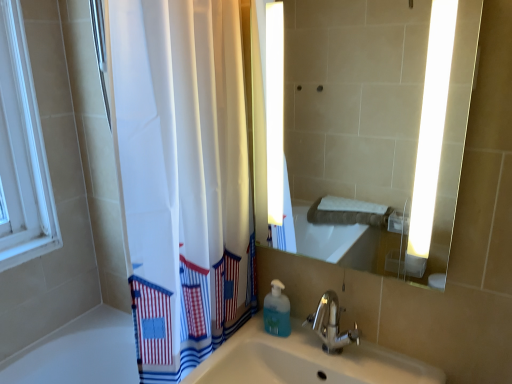
The height and width of the screenshot is (384, 512). What do you see at coordinates (277, 311) in the screenshot? I see `blue translucent soap dispenser at lower center` at bounding box center [277, 311].

Describe the element at coordinates (354, 97) in the screenshot. I see `matte glass mirror at center` at that location.

You are a GUI agent. You are given a task and a screenshot of the screen. Output one action in this format:
    pyautogui.click(x=<x>, y=<y>)
    Task: Click on the chrome metallic faucet at center
    The height and width of the screenshot is (384, 512).
    Given the screenshot: What is the action you would take?
    pyautogui.click(x=331, y=324)

Is blue translucent soap dispenser at lower center located within matte glass mirror at center?

That's incorrect, blue translucent soap dispenser at lower center is not inside matte glass mirror at center.

Could you tell me if matte glass mirror at center is turned towards blue translucent soap dispenser at lower center?

No, matte glass mirror at center is not aimed at blue translucent soap dispenser at lower center.

From the image's perspective, between matte glass mirror at center and blue translucent soap dispenser at lower center, who is located below?

From the image's view, blue translucent soap dispenser at lower center is below.

Is matte glass mirror at center behind blue translucent soap dispenser at lower center?

No, the depth of matte glass mirror at center is less than that of blue translucent soap dispenser at lower center.

Find the location of a particular element. The image size is (512, 384). soap dispenser below the chrome metallic faucet at center (from a real-world perspective) is located at coordinates (277, 311).

Is chrome metallic faucet at center positioned with its back to blue translucent soap dispenser at lower center?

chrome metallic faucet at center does not have its back to blue translucent soap dispenser at lower center.

Is chrome metallic faucet at center shorter than blue translucent soap dispenser at lower center?

No, chrome metallic faucet at center is not shorter than blue translucent soap dispenser at lower center.

Who is smaller, chrome metallic faucet at center or blue translucent soap dispenser at lower center?

With smaller size is blue translucent soap dispenser at lower center.

Consider the image. Is matte glass mirror at center aimed at chrome metallic faucet at center?

No, matte glass mirror at center is not facing towards chrome metallic faucet at center.

From the picture: From a real-world perspective, is matte glass mirror at center located higher than chrome metallic faucet at center?

Indeed, from a real-world perspective, matte glass mirror at center stands above chrome metallic faucet at center.

Based on the photo, is matte glass mirror at center situated inside chrome metallic faucet at center or outside?

matte glass mirror at center exists outside the volume of chrome metallic faucet at center.

Considering the sizes of objects blue translucent soap dispenser at lower center and matte glass mirror at center in the image provided, who is smaller, blue translucent soap dispenser at lower center or matte glass mirror at center?

With smaller size is blue translucent soap dispenser at lower center.

Is blue translucent soap dispenser at lower center taller than matte glass mirror at center?

Incorrect, the height of blue translucent soap dispenser at lower center is not larger of that of matte glass mirror at center.

How many degrees apart are the facing directions of blue translucent soap dispenser at lower center and matte glass mirror at center?

0.0996 degrees separate the facing orientations of blue translucent soap dispenser at lower center and matte glass mirror at center.

Considering the relative sizes of blue translucent soap dispenser at lower center and chrome metallic faucet at center in the image provided, is blue translucent soap dispenser at lower center smaller than chrome metallic faucet at center?

Indeed, blue translucent soap dispenser at lower center has a smaller size compared to chrome metallic faucet at center.

Is point (280, 320) farther from viewer compared to point (331, 310)?

No, it is not.

In the image, there is a chrome metallic faucet at center. At what (x,y) coordinates should I click in order to perform the action: click on soap dispenser below it (from a real-world perspective). Please return your answer as a coordinate pair (x, y). Looking at the image, I should click on (277, 311).

Is blue translucent soap dispenser at lower center positioned beyond the bounds of chrome metallic faucet at center?

That's correct, blue translucent soap dispenser at lower center is outside of chrome metallic faucet at center.

The image size is (512, 384). Identify the location of tap that appears on the left of matte glass mirror at center. (331, 324).

Is chrome metallic faucet at center wider than matte glass mirror at center?

Indeed, chrome metallic faucet at center has a greater width compared to matte glass mirror at center.

Choose the correct answer: Is chrome metallic faucet at center inside matte glass mirror at center or outside it?

chrome metallic faucet at center is spatially situated outside matte glass mirror at center.

In the image, is chrome metallic faucet at center positioned in front of or behind matte glass mirror at center?

Visually, chrome metallic faucet at center is located behind matte glass mirror at center.

This screenshot has height=384, width=512. Find the location of `soap dispenser behind the matte glass mirror at center`. soap dispenser behind the matte glass mirror at center is located at coordinates coord(277,311).

I want to click on tap below the blue translucent soap dispenser at lower center (from the image's perspective), so click(x=331, y=324).

Based on the photo, considering their positions, is matte glass mirror at center positioned closer to blue translucent soap dispenser at lower center than chrome metallic faucet at center?

Among the two, chrome metallic faucet at center is located nearer to blue translucent soap dispenser at lower center.

Considering their positions, is blue translucent soap dispenser at lower center positioned further to chrome metallic faucet at center than matte glass mirror at center?

Among the two, matte glass mirror at center is located further to chrome metallic faucet at center.

From the image, which object appears to be farther from chrome metallic faucet at center, matte glass mirror at center or blue translucent soap dispenser at lower center?

matte glass mirror at center.

When comparing their distances from blue translucent soap dispenser at lower center, does chrome metallic faucet at center or matte glass mirror at center seem closer?

Based on the image, chrome metallic faucet at center appears to be nearer to blue translucent soap dispenser at lower center.

Looking at the image, which one is located closer to matte glass mirror at center, chrome metallic faucet at center or blue translucent soap dispenser at lower center?

The object closer to matte glass mirror at center is chrome metallic faucet at center.

Looking at the image, which one is located closer to matte glass mirror at center, blue translucent soap dispenser at lower center or chrome metallic faucet at center?

The object closer to matte glass mirror at center is chrome metallic faucet at center.

Identify the location of soap dispenser between matte glass mirror at center and chrome metallic faucet at center in the up-down direction. Image resolution: width=512 pixels, height=384 pixels. (277, 311).